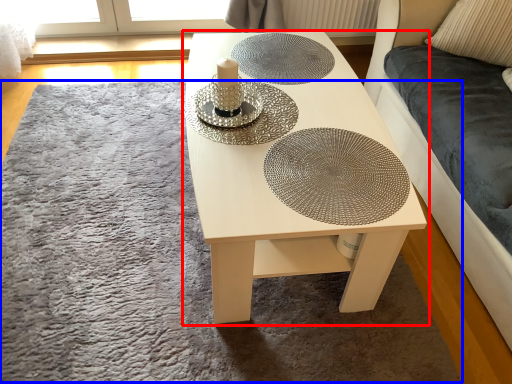
Question: Which object is closer to the camera taking this photo, table (highlighted by a red box) or mat (highlighted by a blue box)?

Choices:
 (A) table
 (B) mat

Answer: (A)